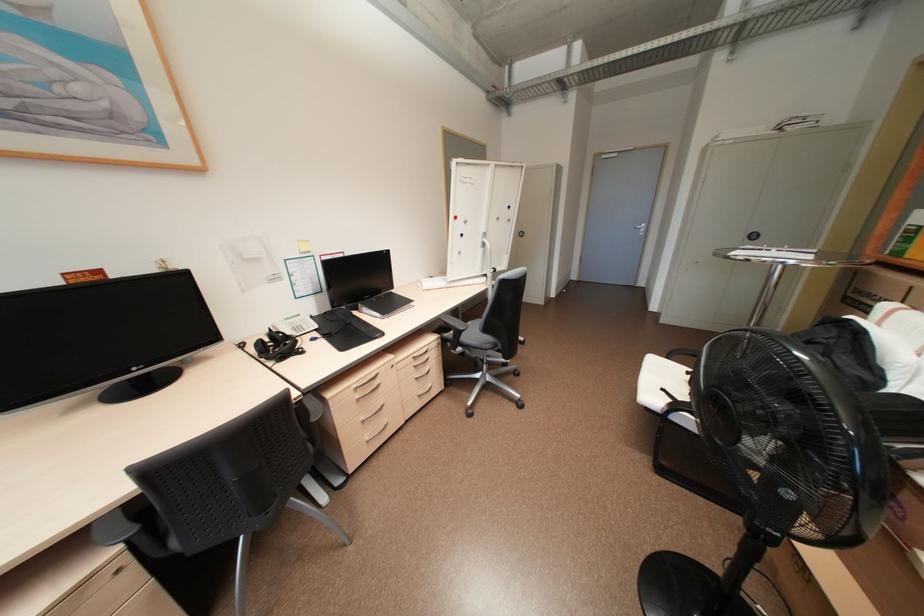
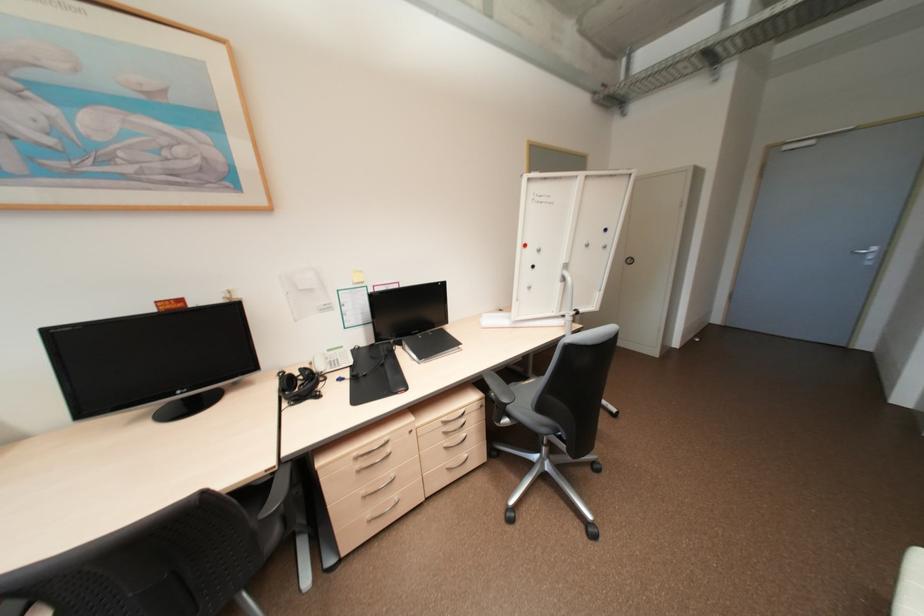
Find the pixel in the second image that matches [421,379] in the first image.

(451, 447)